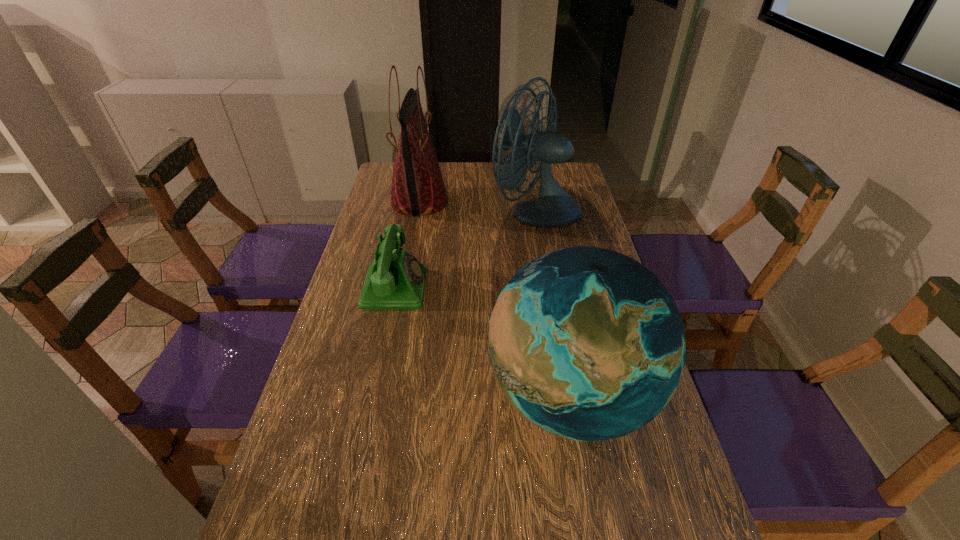
Where is `object that is the third closest to the handbag`? The height and width of the screenshot is (540, 960). object that is the third closest to the handbag is located at coordinates (586, 343).

Locate which object is the closest to the handbag. Please provide its 2D coordinates. Your answer should be formatted as a tuple, i.e. [(x, y)], where the tuple contains the x and y coordinates of a point satisfying the conditions above.

[(554, 207)]

At what (x,y) coordinates should I click in order to perform the action: click on free location that satisfies the following two spatial constraints: 1. in front of the fan to blow air; 2. on the left side of the nearest object. Please return your answer as a coordinate pair (x, y). This screenshot has width=960, height=540. Looking at the image, I should click on (567, 396).

At what (x,y) coordinates should I click in order to perform the action: click on free location that satisfies the following two spatial constraints: 1. in front of the third tallest object to blow air; 2. on the right side of the fan. Please return your answer as a coordinate pair (x, y). Image resolution: width=960 pixels, height=540 pixels. Looking at the image, I should click on (567, 396).

Image resolution: width=960 pixels, height=540 pixels. I want to click on vacant space that satisfies the following two spatial constraints: 1. in front of the fan to blow air; 2. on the right side of the third tallest object, so click(x=567, y=396).

Where is `vacant position in the image that satisfies the following two spatial constraints: 1. on the dial of the shortest object; 2. on the left side of the nearest object`? Image resolution: width=960 pixels, height=540 pixels. vacant position in the image that satisfies the following two spatial constraints: 1. on the dial of the shortest object; 2. on the left side of the nearest object is located at coordinates (372, 396).

At what (x,y) coordinates should I click in order to perform the action: click on free space that satisfies the following two spatial constraints: 1. on the back side of the nearest object; 2. on the dial of the second nearest object. Please return your answer as a coordinate pair (x, y). The image size is (960, 540). Looking at the image, I should click on (551, 288).

Find the location of a particular element. vacant space that satisfies the following two spatial constraints: 1. on the dial of the shortest object; 2. on the back side of the nearest object is located at coordinates (372, 396).